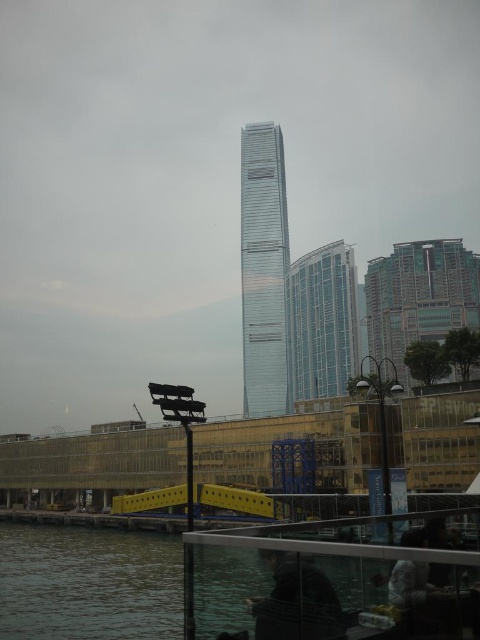
You are standing on the waterfront promenade and want to locate the point at coordinates [321,323]. According to the scene, where exactly is this point located?

The point at coordinates [321,323] is located on the clear glass building at center.

You are standing on the waterfront promenade and see the clear glass building at center and the dark gray fabric jacket at lower center. Which object is closer to you?

The dark gray fabric jacket at lower center is behind the clear glass building at center, so the clear glass building at center is closer to you.

You are standing on the waterfront promenade and want to take a photo of both the clear water at lower left and the clear glass building at center. Which object should you focus on first to ensure both are in the frame?

You should focus on the clear water at lower left first because it is closer to you than the clear glass building at center, ensuring both are in the frame by adjusting the camera angle accordingly.